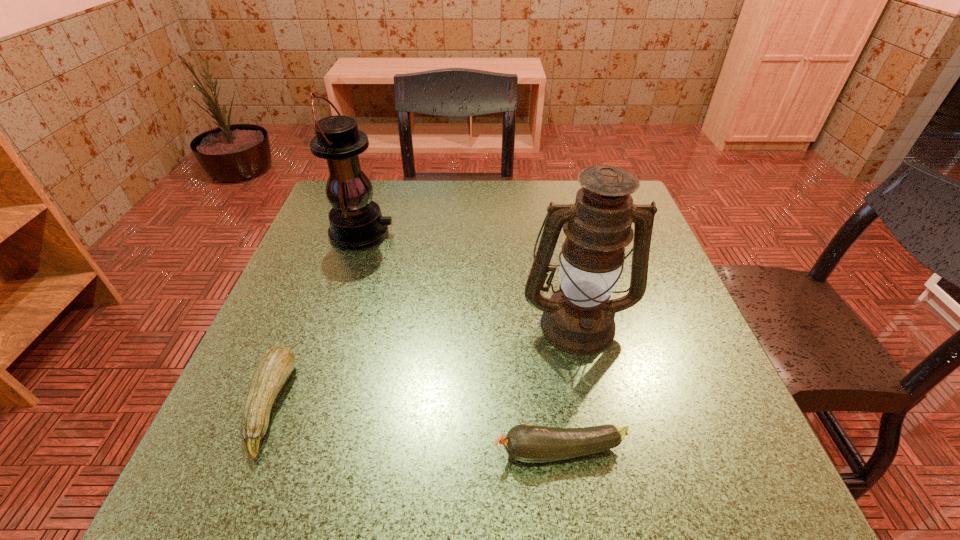
Locate an element on the screen. Image resolution: width=960 pixels, height=540 pixels. unoccupied area between the lantern and the right zucchini is located at coordinates (461, 342).

This screenshot has width=960, height=540. I want to click on free space between the left zucchini and the right zucchini, so click(x=415, y=428).

Where is `vacant area between the left zucchini and the right zucchini`? The image size is (960, 540). vacant area between the left zucchini and the right zucchini is located at coordinates (415, 428).

This screenshot has height=540, width=960. I want to click on vacant region between the lantern and the left zucchini, so click(315, 319).

This screenshot has width=960, height=540. In order to click on free spot between the right zucchini and the left zucchini in this screenshot , I will do `click(415, 428)`.

I want to click on free space that is in between the lantern and the right zucchini, so click(461, 342).

At what (x,y) coordinates should I click in order to perform the action: click on free spot between the right zucchini and the lantern. Please return your answer as a coordinate pair (x, y). This screenshot has height=540, width=960. Looking at the image, I should click on (461, 342).

This screenshot has width=960, height=540. What are the coordinates of `free spot between the second farthest object and the right zucchini` in the screenshot? It's located at (568, 387).

Find the location of a particular element. free spot between the left zucchini and the farthest object is located at coordinates (315, 319).

At what (x,y) coordinates should I click in order to perform the action: click on free space between the left zucchini and the oil lamp. Please return your answer as a coordinate pair (x, y). This screenshot has width=960, height=540. Looking at the image, I should click on (422, 364).